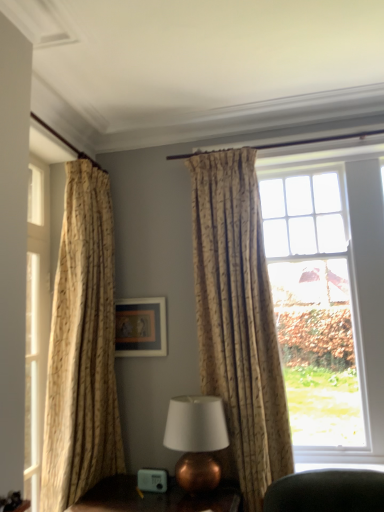
Question: Is point (94, 499) closer or farther from the camera than point (354, 308)?

Choices:
 (A) farther
 (B) closer

Answer: (B)

Question: From the image's perspective, relative to clear glass window at upper right, is copper metallic table lamp at lower center above or below?

Choices:
 (A) above
 (B) below

Answer: (B)

Question: Which of these objects is positioned farthest from the copper metallic table lamp at center?

Choices:
 (A) beige textured curtain at left, the 2th curtain viewed from the right
 (B) copper metallic table lamp at lower center
 (C) matte gold picture frame at center
 (D) clear glass window at upper right
 (E) beige textured curtain at center, which is the first curtain from right to left

Answer: (D)

Question: Which is nearer to the copper metallic table lamp at center?

Choices:
 (A) matte gold picture frame at center
 (B) copper metallic table lamp at lower center
 (C) beige textured curtain at left, the 2th curtain viewed from the right
 (D) clear glass window at upper right
 (E) beige textured curtain at center, which is the first curtain from right to left

Answer: (B)